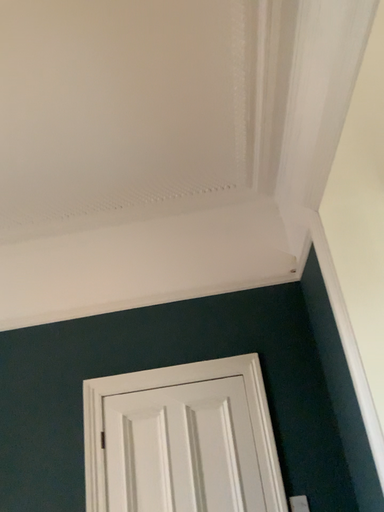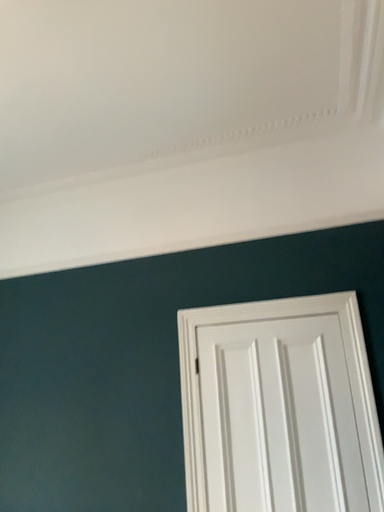
Question: How did the camera likely rotate when shooting the video?

Choices:
 (A) rotated left
 (B) rotated right

Answer: (A)